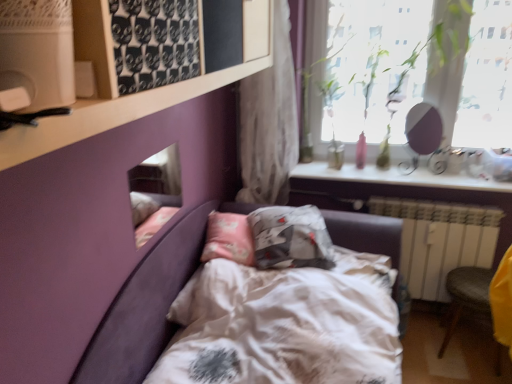
Locate an element on the screen. Image resolution: width=512 pixels, height=384 pixels. free space above white painted metal radiator at lower right (from a real-world perspective) is located at coordinates (428, 197).